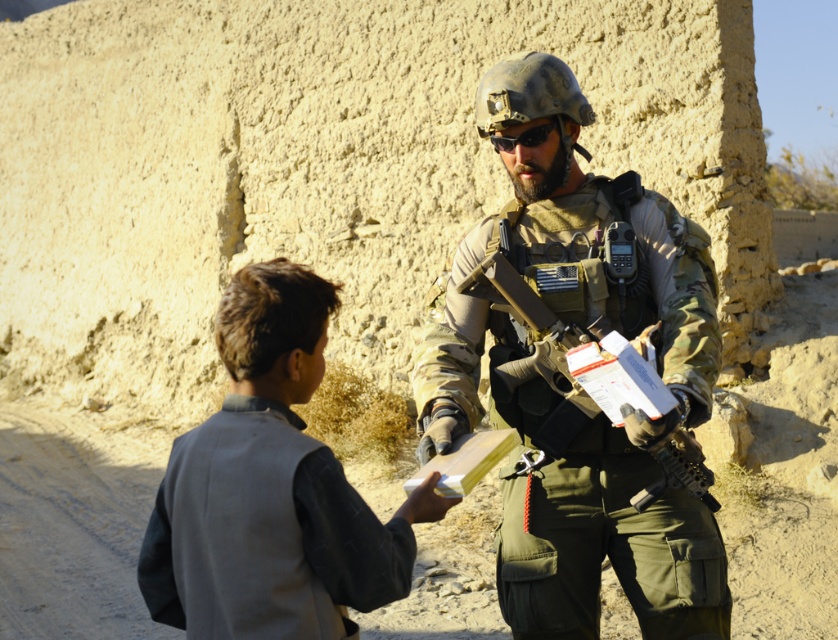
Question: Can you confirm if light gray fabric shirt at lower left is bigger than camouflage fabric rifle at center?

Choices:
 (A) yes
 (B) no

Answer: (B)

Question: Among these objects, which one is nearest to the camera?

Choices:
 (A) camouflage fabric rifle at center
 (B) light gray fabric shirt at lower left

Answer: (B)

Question: Is light gray fabric shirt at lower left smaller than matte black goggles at center?

Choices:
 (A) yes
 (B) no

Answer: (B)

Question: Does camouflage uniform at center have a lesser width compared to light gray fabric shirt at lower left?

Choices:
 (A) yes
 (B) no

Answer: (B)

Question: Which object appears farthest from the camera in this image?

Choices:
 (A) light gray fabric shirt at lower left
 (B) matte black goggles at center

Answer: (B)

Question: Which object is the closest to the light gray fabric shirt at lower left?

Choices:
 (A) camouflage fabric rifle at center
 (B) camouflage uniform at center

Answer: (A)